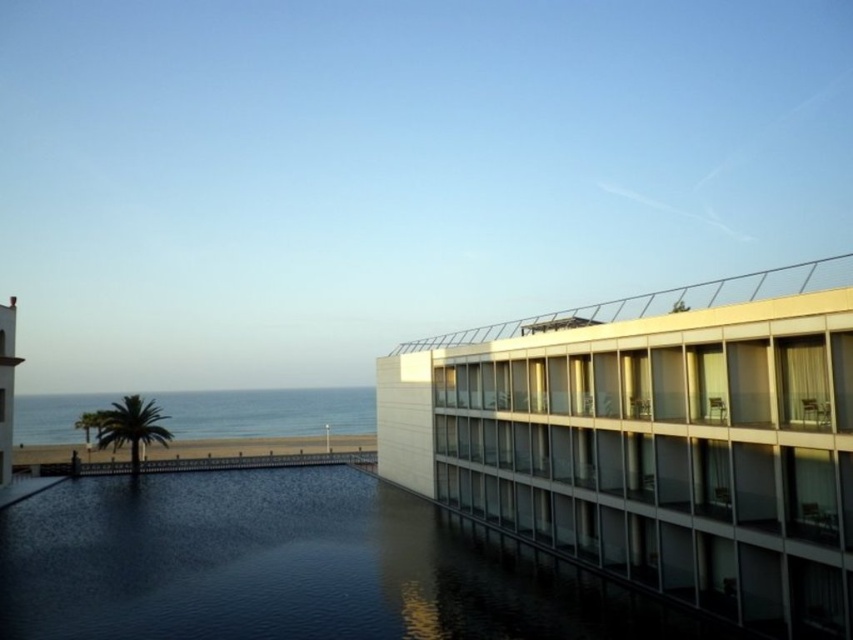
Question: Observing the image, what is the correct spatial positioning of white glass balcony at upper right in reference to smooth white tower at left?

Choices:
 (A) right
 (B) left

Answer: (A)

Question: Based on their relative distances, which object is farther from the white glass balcony at upper right?

Choices:
 (A) white glass building at right
 (B) smooth white tower at left

Answer: (B)

Question: Which of the following is the farthest from the observer?

Choices:
 (A) (689, 369)
 (B) (792, 266)

Answer: (B)

Question: Is white glass building at right wider than clear blue water at lower left?

Choices:
 (A) no
 (B) yes

Answer: (A)

Question: In this image, where is clear blue water at lower left located relative to smooth white tower at left?

Choices:
 (A) below
 (B) above

Answer: (A)

Question: Estimate the real-world distances between objects in this image. Which object is farther from the white glass building at right?

Choices:
 (A) white glass balcony at upper right
 (B) clear blue water at lower left
 (C) smooth white tower at left

Answer: (B)